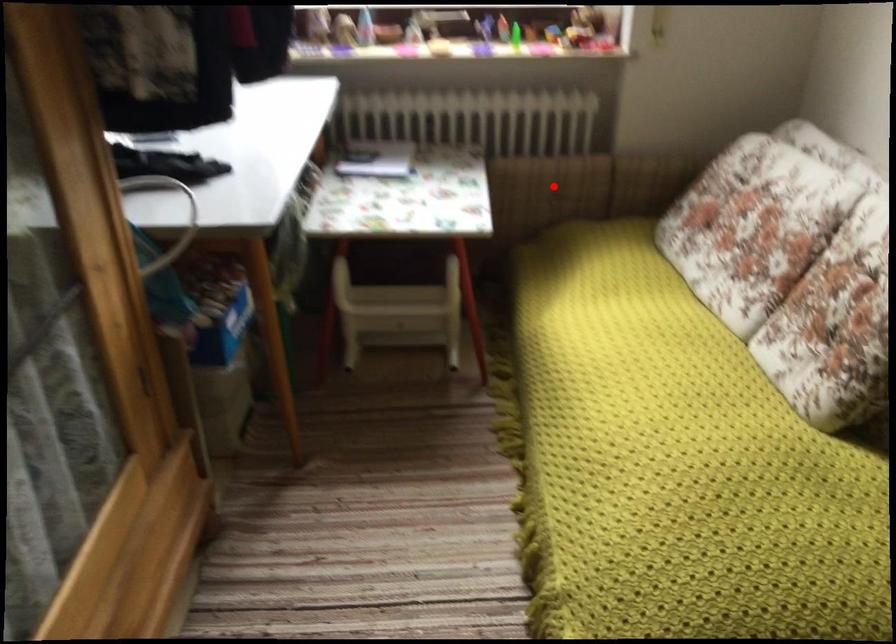
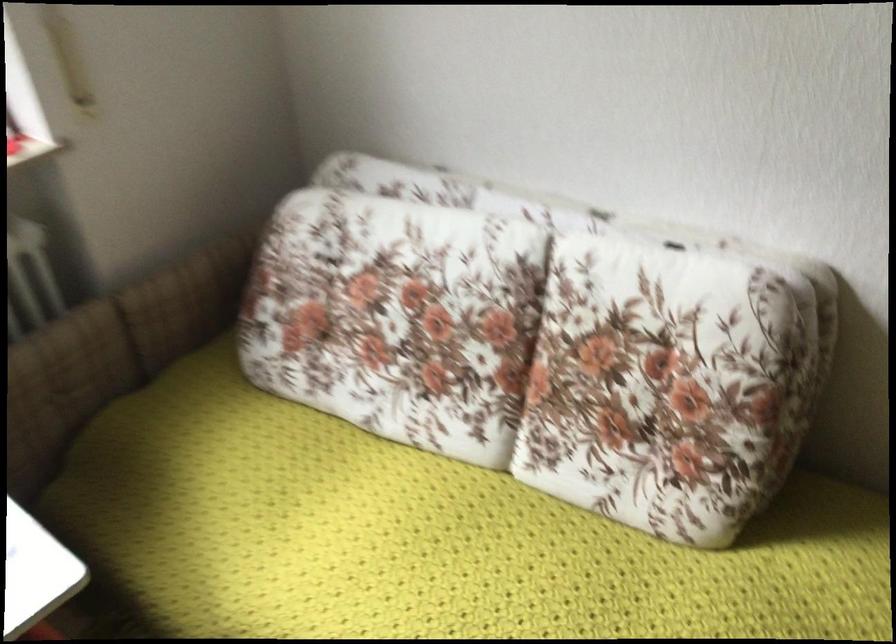
Find the pixel in the second image that matches the highlighted location in the first image.

(63, 384)